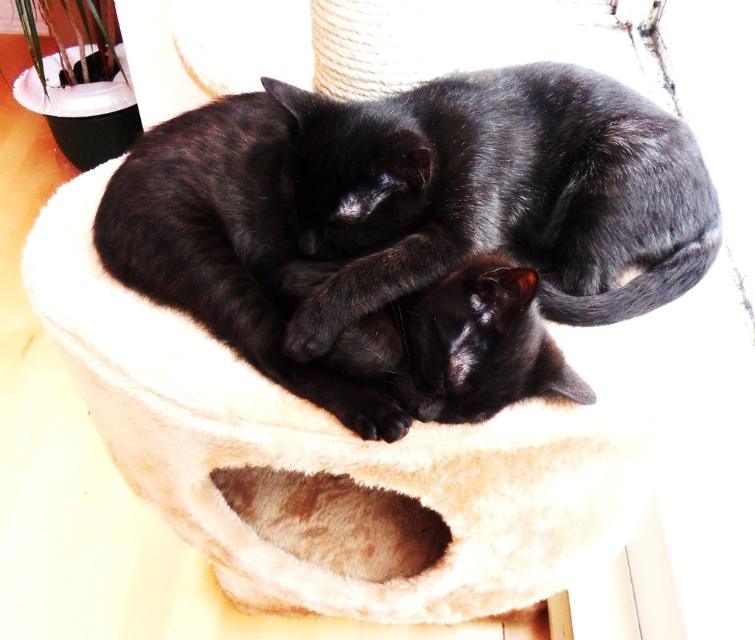
You are a cat owner who wants to place a new toy in the cat bed so that it is equally distant from both black fur cats. Given that the distance between the beige plush cat bed at center and black fur cat at center is 11.16 inches, where should you place the toy?

The toy should be placed at the center of the beige plush cat bed at center since the black fur cat at center is 11.16 inches away from the bed, and placing the toy at the bed center ensures equal distance from both cats.

In the scene shown: You are a cat owner who wants to ensure your cats have enough vertical space to climb on their new cat tree. Given the image, does the beige plush cat bed at center provide enough vertical space for the black fur cat at center to climb on?

The beige plush cat bed at center is much taller than the black fur cat at center, so it provides sufficient vertical space for the cat to climb on.

You are a cat owner who wants to ensure your cats have enough space in their beige plush cat bed at center. You have a new cat with a body length of 30 cm. Considering the black fur cat at center already occupies part of the bed, can the new cat fit comfortably?

The beige plush cat bed at center might be wider than the black fur cat at center, so there could be enough space for the new cat with a 30 cm body length to fit comfortably alongside the existing cat.